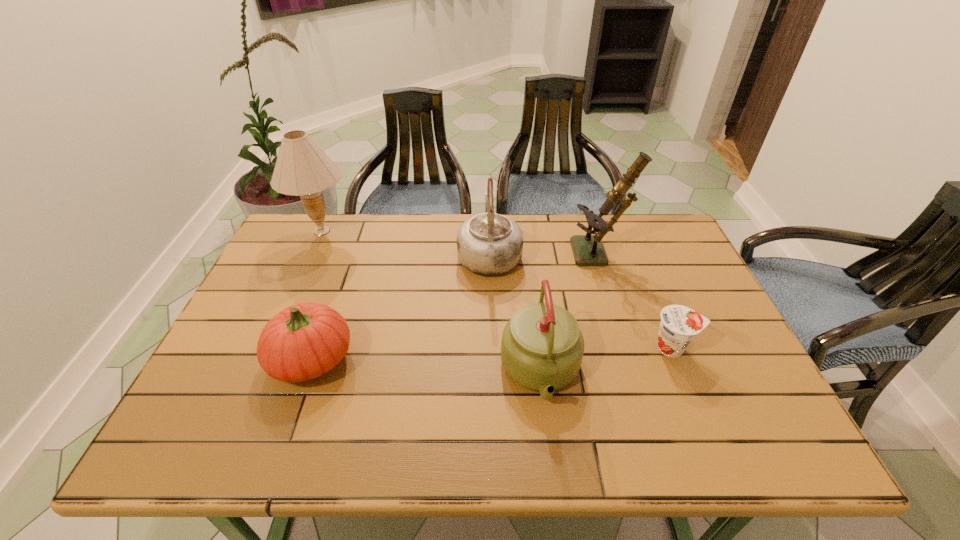
Locate an element on the screen. This screenshot has width=960, height=540. pumpkin positioned at the left edge is located at coordinates coord(302,342).

At what (x,y) coordinates should I click in order to perform the action: click on object located at the right edge. Please return your answer as a coordinate pair (x, y). Image resolution: width=960 pixels, height=540 pixels. Looking at the image, I should click on (679, 324).

Where is `object present at the far left corner`? Image resolution: width=960 pixels, height=540 pixels. object present at the far left corner is located at coordinates (302, 168).

What are the coordinates of `vacant region at the far edge of the desktop` in the screenshot? It's located at (384, 235).

Where is `blank space at the near edge of the desktop`? blank space at the near edge of the desktop is located at coordinates (342, 420).

Find the location of a particular element. vacant space at the left edge of the desktop is located at coordinates (258, 316).

Where is `vacant space at the right edge of the desktop`? vacant space at the right edge of the desktop is located at coordinates (701, 303).

This screenshot has height=540, width=960. I want to click on vacant space at the far right corner, so 678,250.

I want to click on vacant space in between the lampshade and the nearer kettle, so click(x=431, y=302).

This screenshot has height=540, width=960. Identify the location of free space between the lampshade and the fifth tallest object. (317, 295).